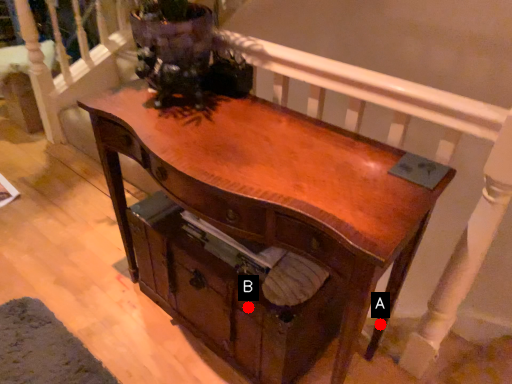
Question: Two points are circled on the image, labeled by A and B beside each circle. Among these points, which one is nearest to the camera?

Choices:
 (A) A is closer
 (B) B is closer

Answer: (B)